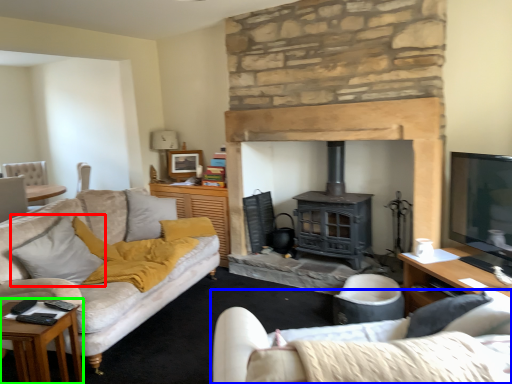
Question: Which object is positioned farthest from pillow (highlighted by a red box)? Select from studio couch (highlighted by a blue box) and table (highlighted by a green box).

Choices:
 (A) studio couch
 (B) table

Answer: (A)